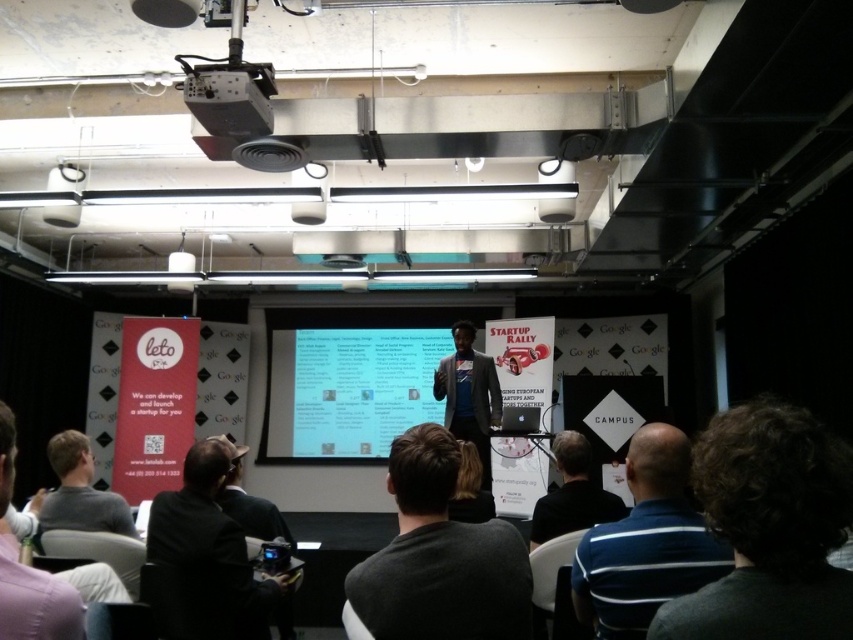
You are a photographer positioned at the back of the room. You need to take a photo of the matte black projector at upper center but there is someone wearing a dark gray shirt at lower left blocking your view. Can you adjust your angle to capture the projector without the person blocking it?

The dark gray shirt at lower left is much taller than the matte black projector at upper center. Since the person is taller, adjusting your angle might not be sufficient to avoid the obstruction. Consider moving to a different position with a clearer line of sight.

In the presentation setting, there is a point marked at coordinates (213, 548). Based on the scene description, what object or feature is located at this point?

The point at coordinates (213, 548) marks the location of the dark gray shirt at lower left.